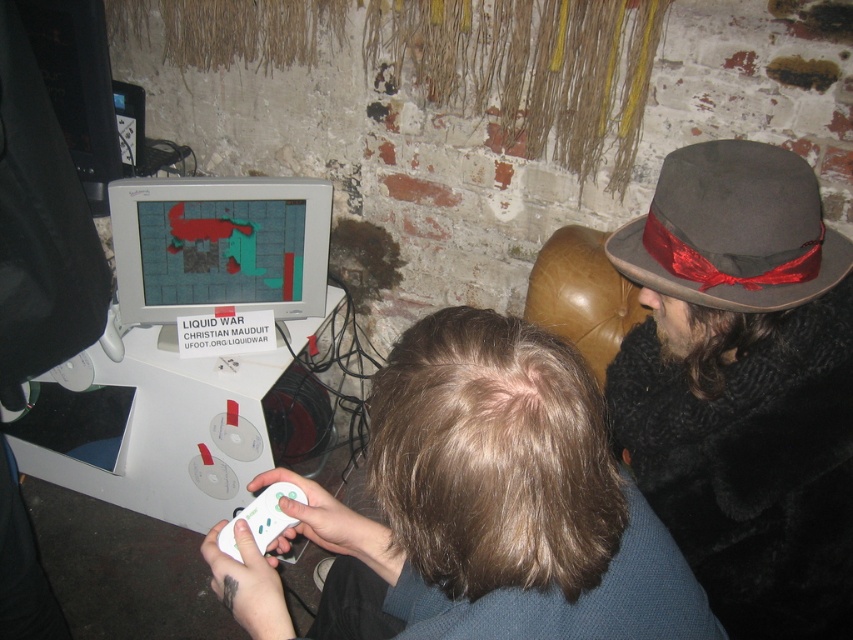
Question: Can you confirm if matte plastic monitor at center is smaller than white plastic game controller at lower center?

Choices:
 (A) no
 (B) yes

Answer: (A)

Question: Which point is closer to the camera?

Choices:
 (A) (262, 532)
 (B) (315, 200)
 (C) (700, 227)
 (D) (381, 620)

Answer: (C)

Question: Based on their relative distances, which object is farther from the dark brown fur coat at right?

Choices:
 (A) dark brown hair at center
 (B) white plastic game controller at lower center

Answer: (B)

Question: Among these objects, which one is farthest from the camera?

Choices:
 (A) dark brown hair at center
 (B) matte plastic monitor at center
 (C) dark brown felt fedora at right
 (D) white plastic game controller at lower center

Answer: (B)

Question: Is dark brown hair at center bigger than matte plastic monitor at center?

Choices:
 (A) yes
 (B) no

Answer: (A)

Question: Considering the relative positions of dark brown fur coat at right and matte plastic monitor at center in the image provided, where is dark brown fur coat at right located with respect to matte plastic monitor at center?

Choices:
 (A) right
 (B) left

Answer: (A)